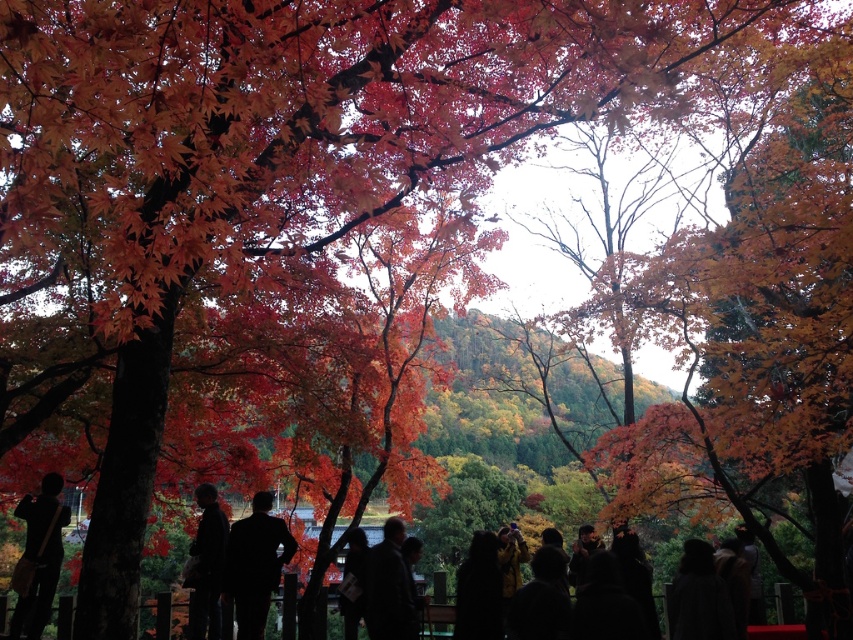
Question: Is black fabric at center positioned at the back of dark gray coat at center?

Choices:
 (A) yes
 (B) no

Answer: (A)

Question: In this image, where is black fabric at center located relative to dark fabric jacket at center?

Choices:
 (A) left
 (B) right

Answer: (B)

Question: Does dark gray coat at center appear on the left side of dark fabric jacket at center?

Choices:
 (A) no
 (B) yes

Answer: (A)

Question: Which object is closer to the camera taking this photo?

Choices:
 (A) black fabric at center
 (B) silhouette fabric bag at lower left
 (C) dark fabric jacket at center

Answer: (B)

Question: Which point is closer to the camera taking this photo?

Choices:
 (A) (253, 566)
 (B) (222, 564)
 (C) (381, 593)
 (D) (45, 570)

Answer: (C)

Question: Among these objects, which one is nearest to the camera?

Choices:
 (A) silhouette fabric bag at lower left
 (B) dark gray coat at center
 (C) dark fabric jacket at center

Answer: (A)